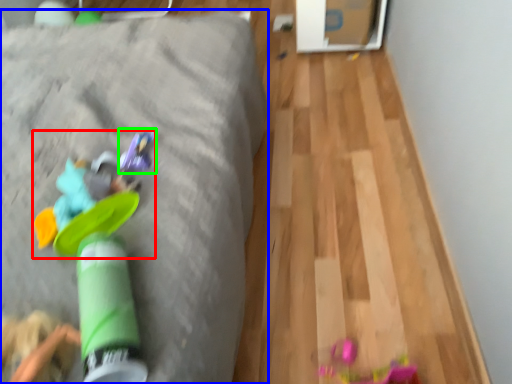
Question: Estimate the real-world distances between objects in this image. Which object is closer to toy (highlighted by a red box), furniture (highlighted by a blue box) or toy (highlighted by a green box)?

Choices:
 (A) furniture
 (B) toy

Answer: (B)